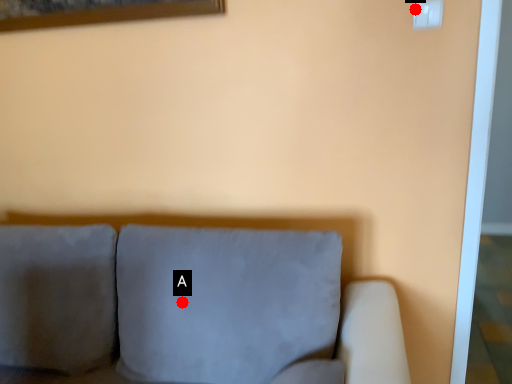
Question: Two points are circled on the image, labeled by A and B beside each circle. Which point appears farthest from the camera in this image?

Choices:
 (A) A is further
 (B) B is further

Answer: (A)